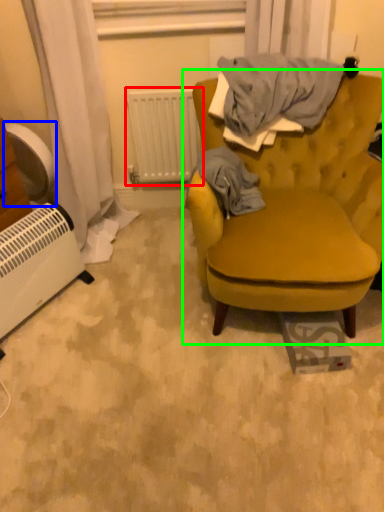
Question: Estimate the real-world distances between objects in this image. Which object is farther from radiator (highlighted by a red box), fan (highlighted by a blue box) or chair (highlighted by a green box)?

Choices:
 (A) fan
 (B) chair

Answer: (A)